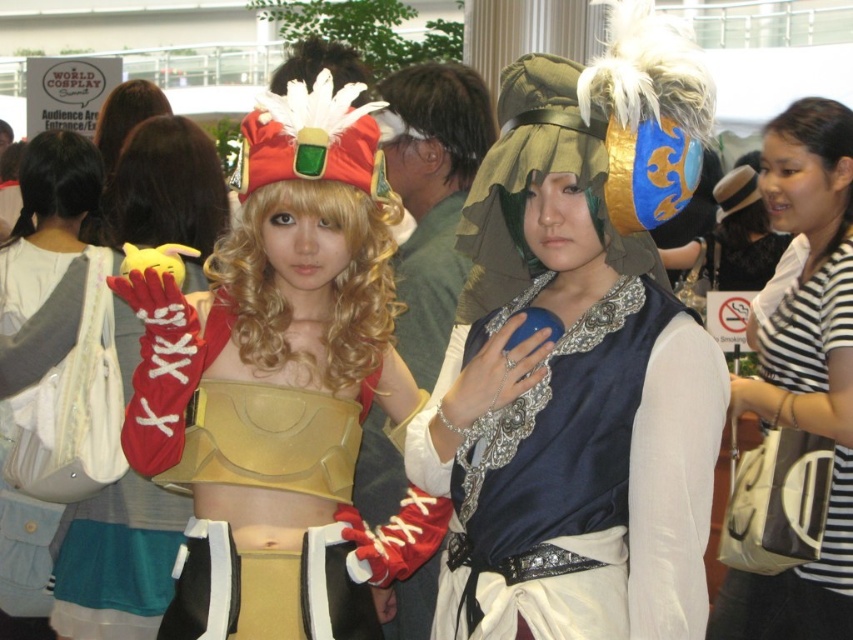
Does shiny silver armor at center appear on the left side of camouflage fabric headdress at center?

Indeed, shiny silver armor at center is positioned on the left side of camouflage fabric headdress at center.

Who is more distant from viewer, (444, 253) or (532, 104)?

The point (444, 253) is behind.

Is point (428, 179) more distant than point (498, 129)?

Yes, it is behind point (498, 129).

Locate an element on the screen. shiny silver armor at center is located at coordinates (431, 196).

Can you confirm if satin blue dress at center is positioned below camouflage fabric headdress at center?

Yes.

Is satin blue dress at center positioned in front of camouflage fabric headdress at center?

Yes, it is in front of camouflage fabric headdress at center.

You are a GUI agent. You are given a task and a screenshot of the screen. Output one action in this format:
    pyautogui.click(x=<x>, y=<y>)
    Task: Click on the satin blue dress at center
    
    Given the screenshot: What is the action you would take?
    pyautogui.click(x=566, y=401)

Image resolution: width=853 pixels, height=640 pixels. What do you see at coordinates (566, 401) in the screenshot?
I see `satin blue dress at center` at bounding box center [566, 401].

Which of these two, satin blue dress at center or shiny silver armor at center, stands taller?

Standing taller between the two is satin blue dress at center.

This screenshot has height=640, width=853. What do you see at coordinates (566, 401) in the screenshot?
I see `satin blue dress at center` at bounding box center [566, 401].

The width and height of the screenshot is (853, 640). In order to click on satin blue dress at center in this screenshot , I will do `click(566, 401)`.